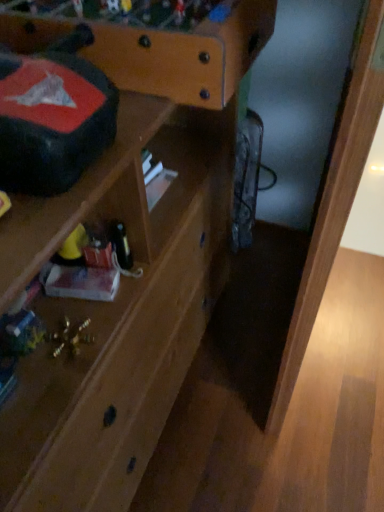
Question: Is point (297, 364) closer or farther from the camera than point (145, 198)?

Choices:
 (A) closer
 (B) farther

Answer: (B)

Question: Is light brown wood at lower right in front of or behind wooden shelf at center in the image?

Choices:
 (A) behind
 (B) front

Answer: (A)

Question: Estimate the real-world distances between objects in this image. Which object is farther from the matte black writing desk at upper left?

Choices:
 (A) light brown wood at lower right
 (B) wooden shelf at center

Answer: (A)

Question: Which of these objects is positioned farthest from the matte black writing desk at upper left?

Choices:
 (A) wooden shelf at center
 (B) light brown wood at lower right

Answer: (B)